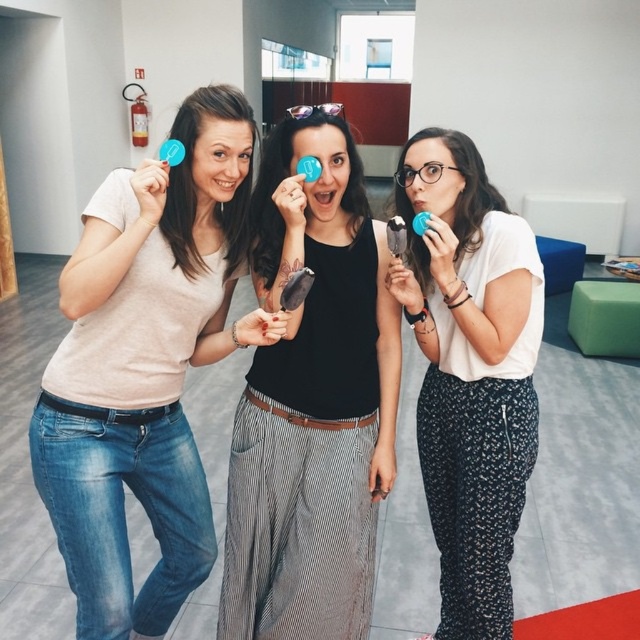
Who is positioned more to the left, matte pink t-shirt at left or black matte ice cream at center?

From the viewer's perspective, matte pink t-shirt at left appears more on the left side.

At what (x,y) coordinates should I click in order to perform the action: click on matte pink t-shirt at left. Please return your answer as a coordinate pair (x, y). Looking at the image, I should click on (145, 365).

What do you see at coordinates (312, 401) in the screenshot? I see `black matte ice cream at center` at bounding box center [312, 401].

Does point (269, 611) come in front of point (488, 282)?

No, it is not.

Locate an element on the screen. black matte ice cream at center is located at coordinates (312, 401).

Image resolution: width=640 pixels, height=640 pixels. I want to click on black matte ice cream at center, so click(312, 401).

Does matte pink t-shirt at left have a lesser width compared to white matte shirt at center?

In fact, matte pink t-shirt at left might be wider than white matte shirt at center.

The height and width of the screenshot is (640, 640). In order to click on matte pink t-shirt at left in this screenshot , I will do (145, 365).

Identify the location of matte pink t-shirt at left. (145, 365).